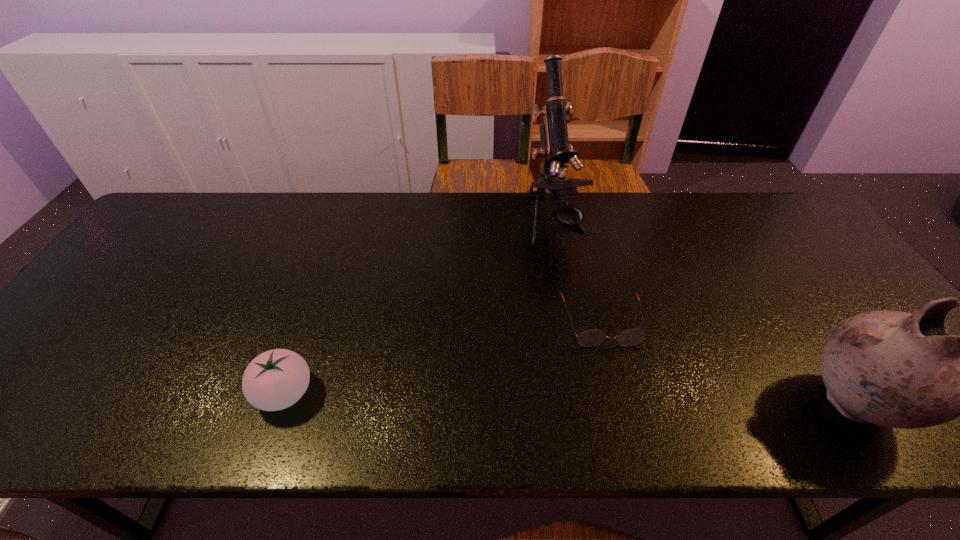
The width and height of the screenshot is (960, 540). What are the coordinates of `free space on the desktop that is between the tomato and the rightmost object and is positioned on the temples of the third nearest object` in the screenshot? It's located at (622, 399).

Where is `free space on the desktop that is between the second shortest object and the rightmost object and is positioned through the eyepiece of the microscope`? The height and width of the screenshot is (540, 960). free space on the desktop that is between the second shortest object and the rightmost object and is positioned through the eyepiece of the microscope is located at coordinates (646, 400).